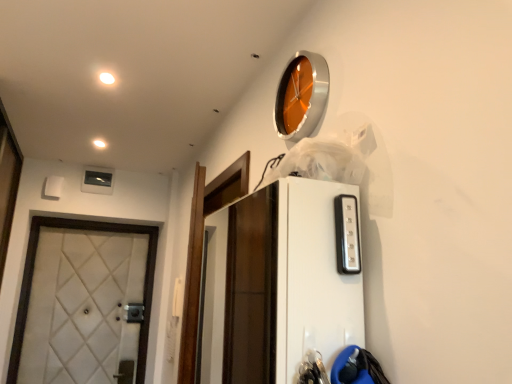
What is the approximate width of white quilted fabric door at left?

The width of white quilted fabric door at left is 5.16 inches.

Where is `orange metallic clock at upper center`? Image resolution: width=512 pixels, height=384 pixels. orange metallic clock at upper center is located at coordinates (301, 96).

Is orange metallic clock at upper center turned away from matte white light at upper left, which is counted as the second light, starting from the top?

No, orange metallic clock at upper center's orientation is not away from matte white light at upper left, which is counted as the second light, starting from the top.

In the scene shown: Is the depth of orange metallic clock at upper center less than that of matte white light at upper left, which appears as the first light when ordered from the bottom?

Yes, orange metallic clock at upper center is closer to the camera.

From a real-world perspective, relative to matte white light at upper left, which appears as the first light when viewed from the left, is orange metallic clock at upper center vertically above or below?

orange metallic clock at upper center is below matte white light at upper left, which appears as the first light when viewed from the left.

From the image's perspective, is orange metallic clock at upper center located above or below matte white light at upper left, which appears as the first light when ordered from the bottom?

Clearly, from the image's perspective, orange metallic clock at upper center is below matte white light at upper left, which appears as the first light when ordered from the bottom.

Which object is closer to the camera, orange metallic clock at upper center or white quilted fabric door at left?

Positioned in front is orange metallic clock at upper center.

Can you confirm if orange metallic clock at upper center is wider than white quilted fabric door at left?

No, orange metallic clock at upper center is not wider than white quilted fabric door at left.

Is orange metallic clock at upper center far away from white quilted fabric door at left?

That's right, there is a large distance between orange metallic clock at upper center and white quilted fabric door at left.

Is white glossy light at upper left, marked as the first light in a top-to-bottom arrangement, inside the boundaries of orange metallic clock at upper center, or outside?

The correct answer is: outside.

In the scene shown: How much distance is there between white glossy light at upper left, the first light from the right, and orange metallic clock at upper center?

The distance of white glossy light at upper left, the first light from the right, from orange metallic clock at upper center is 34.44 inches.

Looking at this image, how many degrees apart are the facing directions of white glossy light at upper left, acting as the 1th light starting from the front, and orange metallic clock at upper center?

Result: They differ by 89.4 degrees in their facing directions.

Visually, is white glossy light at upper left, the first light from the right, positioned to the left or to the right of orange metallic clock at upper center?

white glossy light at upper left, the first light from the right, is to the left of orange metallic clock at upper center.

Could you measure the distance between matte white light at upper left, marked as the first light in a back-to-front arrangement, and white quilted fabric door at left?

The distance of matte white light at upper left, marked as the first light in a back-to-front arrangement, from white quilted fabric door at left is 3.30 feet.

Is matte white light at upper left, which appears as the first light when viewed from the left, further to camera compared to white quilted fabric door at left?

No, it is in front of white quilted fabric door at left.

Does point (103, 147) appear closer or farther from the camera than point (74, 223)?

Point (103, 147) is positioned closer to the camera compared to point (74, 223).

Does matte white light at upper left, which appears as the first light when ordered from the bottom, appear on the left side of white quilted fabric door at left?

In fact, matte white light at upper left, which appears as the first light when ordered from the bottom, is to the right of white quilted fabric door at left.

Considering the sizes of white glossy light at upper left, the 2th light when ordered from left to right, and matte white light at upper left, which is counted as the second light, starting from the top, in the image, is white glossy light at upper left, the 2th light when ordered from left to right, wider or thinner than matte white light at upper left, which is counted as the second light, starting from the top,?

white glossy light at upper left, the 2th light when ordered from left to right, is thinner than matte white light at upper left, which is counted as the second light, starting from the top.

Is white glossy light at upper left, placed as the 2th light when sorted from back to front, oriented away from matte white light at upper left, which appears as the first light when viewed from the left?

Yes, matte white light at upper left, which appears as the first light when viewed from the left, is at the back of white glossy light at upper left, placed as the 2th light when sorted from back to front.

Between white glossy light at upper left, placed as the 2th light when sorted from back to front, and matte white light at upper left, which appears as the first light when viewed from the left, which one appears on the right side from the viewer's perspective?

white glossy light at upper left, placed as the 2th light when sorted from back to front.

Considering the relative sizes of white glossy light at upper left, which is the second light from bottom to top, and matte white light at upper left, which is counted as the second light, starting from the right, in the image provided, is white glossy light at upper left, which is the second light from bottom to top, shorter than matte white light at upper left, which is counted as the second light, starting from the right,?

Yes.

From the picture: From a real-world perspective, relative to white glossy light at upper left, placed as the 2th light when sorted from back to front, is white quilted fabric door at left vertically above or below?

In terms of real-world spatial position, white quilted fabric door at left is below white glossy light at upper left, placed as the 2th light when sorted from back to front.

Does white quilted fabric door at left have a lesser height compared to white glossy light at upper left, marked as the first light in a top-to-bottom arrangement?

In fact, white quilted fabric door at left may be taller than white glossy light at upper left, marked as the first light in a top-to-bottom arrangement.

Between white quilted fabric door at left and white glossy light at upper left, marked as the first light in a top-to-bottom arrangement, which one appears on the right side from the viewer's perspective?

From the viewer's perspective, white glossy light at upper left, marked as the first light in a top-to-bottom arrangement, appears more on the right side.

Which is closer to the camera, [144,293] or [106,73]?

The point [106,73] is closer to the camera.

Could you tell me if white glossy light at upper left, the first light from the right, is facing white quilted fabric door at left?

No, white glossy light at upper left, the first light from the right, is not facing towards white quilted fabric door at left.

From a real-world perspective, does white glossy light at upper left, the first light from the right, sit lower than white quilted fabric door at left?

No, from a real-world perspective, white glossy light at upper left, the first light from the right, is not under white quilted fabric door at left.

Which point is more forward, (104, 74) or (29, 246)?

Positioned in front is point (104, 74).

In terms of width, does white glossy light at upper left, which is the second light from bottom to top, look wider or thinner when compared to white quilted fabric door at left?

white glossy light at upper left, which is the second light from bottom to top, is thinner than white quilted fabric door at left.

Image resolution: width=512 pixels, height=384 pixels. In order to click on light that is the 1st one when counting upward from the orange metallic clock at upper center (from the image's perspective) in this screenshot , I will do `click(99, 143)`.

I want to click on door that appears below the orange metallic clock at upper center (from a real-world perspective), so click(32, 276).

Based on their spatial positions, is matte white light at upper left, which is counted as the second light, starting from the top, or white glossy light at upper left, marked as the first light in a top-to-bottom arrangement, closer to orange metallic clock at upper center?

Based on the image, white glossy light at upper left, marked as the first light in a top-to-bottom arrangement, appears to be nearer to orange metallic clock at upper center.

From the image, which object appears to be nearer to white glossy light at upper left, marked as the first light in a top-to-bottom arrangement, matte white light at upper left, marked as the first light in a back-to-front arrangement, or white quilted fabric door at left?

matte white light at upper left, marked as the first light in a back-to-front arrangement, is positioned closer to the anchor white glossy light at upper left, marked as the first light in a top-to-bottom arrangement.

Which object lies nearer to the anchor point matte white light at upper left, which appears as the first light when ordered from the bottom, white glossy light at upper left, the 2th light when ordered from left to right, or orange metallic clock at upper center?

The object closer to matte white light at upper left, which appears as the first light when ordered from the bottom, is white glossy light at upper left, the 2th light when ordered from left to right.

When comparing their distances from white quilted fabric door at left, does white glossy light at upper left, which is the second light from bottom to top, or matte white light at upper left, which is counted as the second light, starting from the top, seem further?

white glossy light at upper left, which is the second light from bottom to top.

Estimate the real-world distances between objects in this image. Which object is closer to white quilted fabric door at left, matte white light at upper left, which appears as the first light when viewed from the left, or orange metallic clock at upper center?

matte white light at upper left, which appears as the first light when viewed from the left, is closer to white quilted fabric door at left.

Based on their spatial positions, is white quilted fabric door at left or white glossy light at upper left, the 2th light when ordered from left to right, closer to orange metallic clock at upper center?

white glossy light at upper left, the 2th light when ordered from left to right, lies closer to orange metallic clock at upper center than the other object.

From the image, which object appears to be nearer to white quilted fabric door at left, matte white light at upper left, the 2th light from the front, or white glossy light at upper left, the first light from the right?

The object closer to white quilted fabric door at left is matte white light at upper left, the 2th light from the front.

When comparing their distances from matte white light at upper left, which is counted as the second light, starting from the right, does white quilted fabric door at left or orange metallic clock at upper center seem further?

orange metallic clock at upper center.

At what (x,y) coordinates should I click in order to perform the action: click on light between orange metallic clock at upper center and matte white light at upper left, the 2th light from the front, from front to back. Please return your answer as a coordinate pair (x, y). This screenshot has width=512, height=384. Looking at the image, I should click on (106, 78).

You are a GUI agent. You are given a task and a screenshot of the screen. Output one action in this format:
    pyautogui.click(x=<x>, y=<y>)
    Task: Click on the light between white glossy light at upper left, the 2th light when ordered from left to right, and white quilted fabric door at left in the up-down direction
    
    Given the screenshot: What is the action you would take?
    pyautogui.click(x=99, y=143)